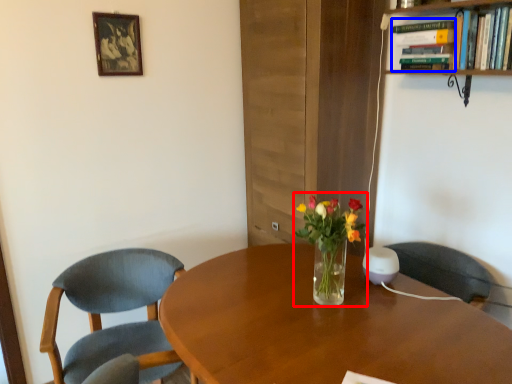
Question: Among these objects, which one is farthest to the camera, floral arrangement (highlighted by a red box) or book (highlighted by a blue box)?

Choices:
 (A) floral arrangement
 (B) book

Answer: (B)